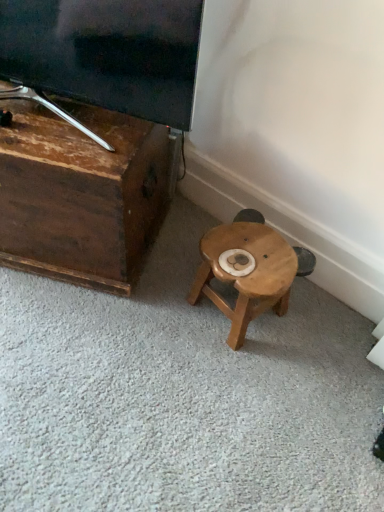
Question: Considering the positions of dark brown wood tv stand at left and wooden stool at center in the image, is dark brown wood tv stand at left taller or shorter than wooden stool at center?

Choices:
 (A) short
 (B) tall

Answer: (B)

Question: Looking at the image, does dark brown wood tv stand at left seem bigger or smaller compared to wooden stool at center?

Choices:
 (A) big
 (B) small

Answer: (A)

Question: In the image, is dark brown wood tv stand at left positioned in front of or behind wooden stool at center?

Choices:
 (A) behind
 (B) front

Answer: (B)

Question: Visually, is wooden stool at center positioned to the left or to the right of dark brown wood tv stand at left?

Choices:
 (A) left
 (B) right

Answer: (B)

Question: Does point (261, 269) appear closer or farther from the camera than point (124, 236)?

Choices:
 (A) farther
 (B) closer

Answer: (B)

Question: Is wooden stool at center bigger or smaller than dark brown wood tv stand at left?

Choices:
 (A) big
 (B) small

Answer: (B)

Question: From a real-world perspective, is wooden stool at center above or below dark brown wood tv stand at left?

Choices:
 (A) above
 (B) below

Answer: (B)